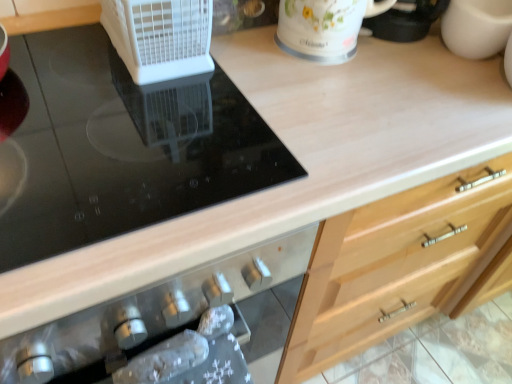
Question: Can you confirm if white floral mug at upper center is wider than black glass cooktop at upper left?

Choices:
 (A) no
 (B) yes

Answer: (A)

Question: Can you see white floral mug at upper center touching black glass cooktop at upper left?

Choices:
 (A) yes
 (B) no

Answer: (B)

Question: Considering the relative sizes of white floral mug at upper center and black glass cooktop at upper left in the image provided, is white floral mug at upper center taller than black glass cooktop at upper left?

Choices:
 (A) yes
 (B) no

Answer: (A)

Question: Is white floral mug at upper center behind black glass cooktop at upper left?

Choices:
 (A) yes
 (B) no

Answer: (A)

Question: Would you say black glass cooktop at upper left is part of white floral mug at upper center's contents?

Choices:
 (A) yes
 (B) no

Answer: (B)

Question: Looking at the image, does white floral mug at upper center seem bigger or smaller compared to white plastic fan at upper left?

Choices:
 (A) small
 (B) big

Answer: (B)

Question: From a real-world perspective, relative to white plastic fan at upper left, is white floral mug at upper center vertically above or below?

Choices:
 (A) below
 (B) above

Answer: (B)

Question: Considering the positions of point (286, 28) and point (177, 34), is point (286, 28) closer or farther from the camera than point (177, 34)?

Choices:
 (A) closer
 (B) farther

Answer: (B)

Question: From their relative heights in the image, would you say white floral mug at upper center is taller or shorter than white plastic fan at upper left?

Choices:
 (A) tall
 (B) short

Answer: (A)

Question: From a real-world perspective, relative to white floral mug at upper center, is white plastic fan at upper left vertically above or below?

Choices:
 (A) above
 (B) below

Answer: (B)

Question: In terms of height, does white plastic fan at upper left look taller or shorter compared to white floral mug at upper center?

Choices:
 (A) short
 (B) tall

Answer: (A)

Question: Considering the positions of white plastic fan at upper left and white floral mug at upper center in the image, is white plastic fan at upper left wider or thinner than white floral mug at upper center?

Choices:
 (A) wide
 (B) thin

Answer: (A)

Question: Considering the positions of white plastic fan at upper left and white floral mug at upper center in the image, is white plastic fan at upper left bigger or smaller than white floral mug at upper center?

Choices:
 (A) small
 (B) big

Answer: (A)

Question: In terms of width, does white floral mug at upper center look wider or thinner when compared to black glass cooktop at upper left?

Choices:
 (A) thin
 (B) wide

Answer: (A)

Question: Would you say white floral mug at upper center is to the left or to the right of black glass cooktop at upper left in the picture?

Choices:
 (A) right
 (B) left

Answer: (A)